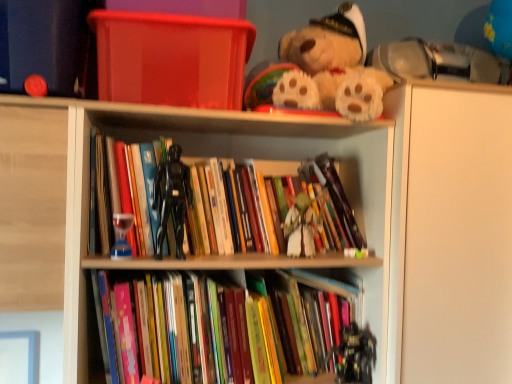
You are a GUI agent. You are given a task and a screenshot of the screen. Output one action in this format:
    pyautogui.click(x=<x>, y=<y>)
    Task: Click on the free area below fluffy beige teddy bear at upper center (from a real-world perspective)
    
    Given the screenshot: What is the action you would take?
    pyautogui.click(x=331, y=125)